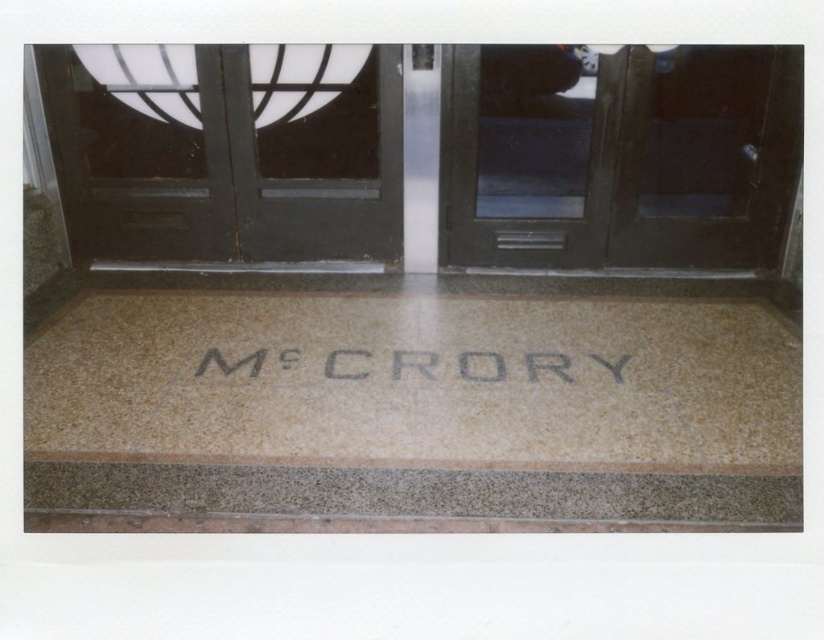
Question: Is clear glass door at center bigger than transparent glass door at center?

Choices:
 (A) no
 (B) yes

Answer: (B)

Question: In this image, where is clear glass door at center located relative to transparent glass door at center?

Choices:
 (A) right
 (B) left

Answer: (B)

Question: Can you confirm if clear glass door at center is bigger than matte black door at center?

Choices:
 (A) no
 (B) yes

Answer: (B)

Question: Among these points, which one is nearest to the camera?

Choices:
 (A) (792, 179)
 (B) (550, 188)
 (C) (118, 115)
 (D) (469, 352)

Answer: (D)

Question: Based on their relative distances, which object is farther from the matte black door at center?

Choices:
 (A) gray stone engraving at center
 (B) transparent glass door at center
 (C) clear glass door at center

Answer: (A)

Question: Estimate the real-world distances between objects in this image. Which object is farther from the gray stone engraving at center?

Choices:
 (A) matte black door at center
 (B) clear glass door at center

Answer: (B)